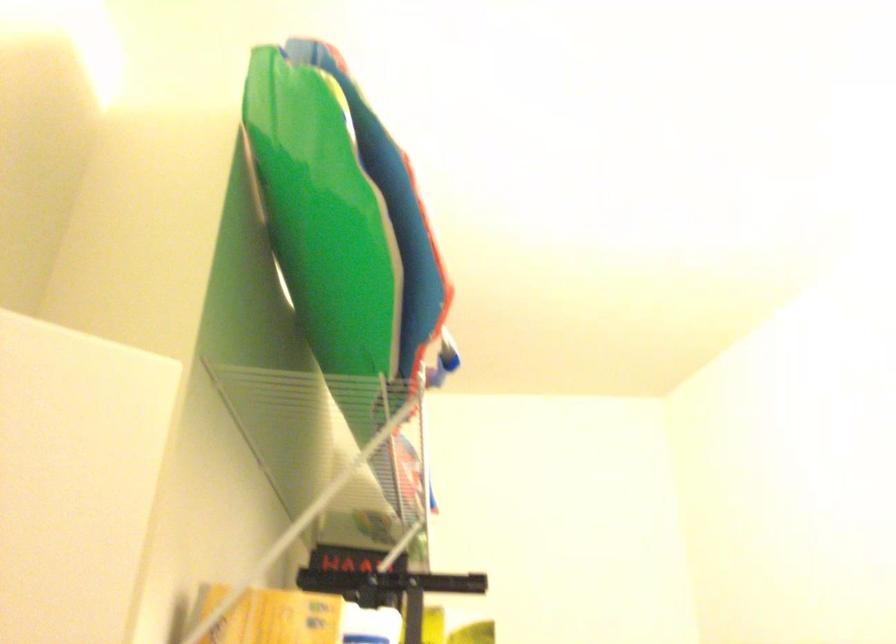
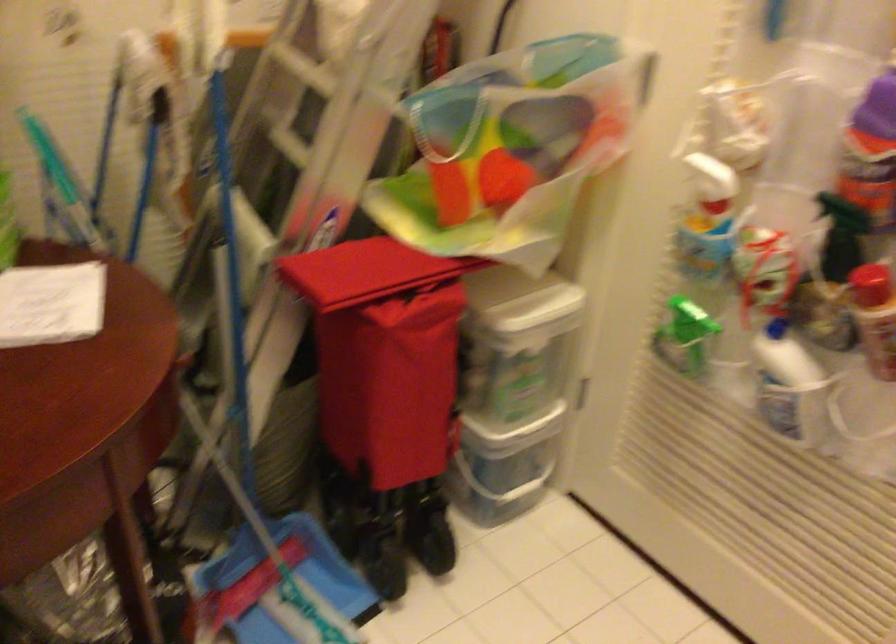
The first image is from the beginning of the video and the second image is from the end. How did the camera likely rotate when shooting the video?

The camera rotated toward right-down.